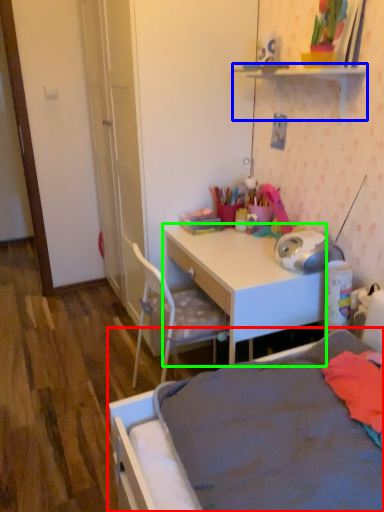
Question: Estimate the real-world distances between objects in this image. Which object is closer to bed (highlighted by a red box), shelf (highlighted by a blue box) or desk (highlighted by a green box)?

Choices:
 (A) shelf
 (B) desk

Answer: (B)